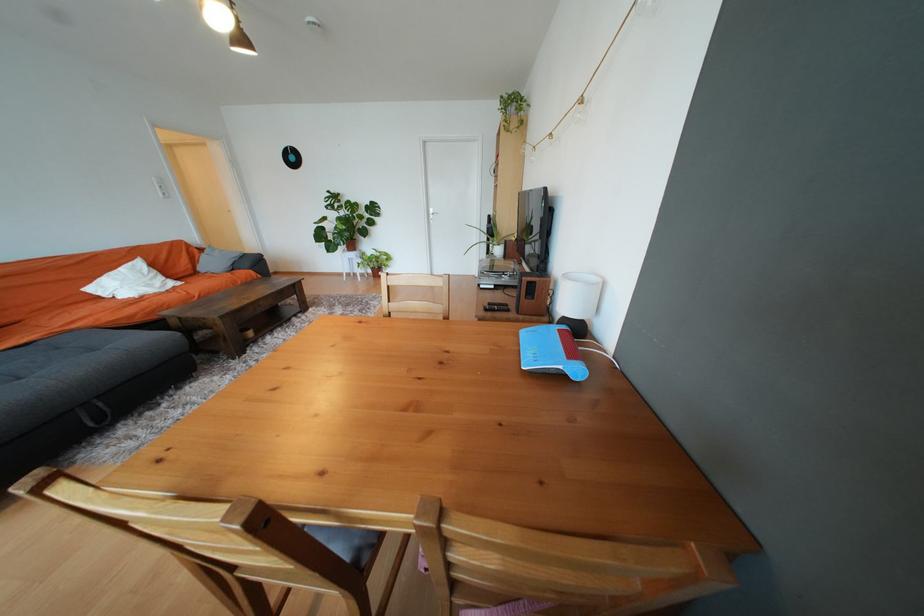
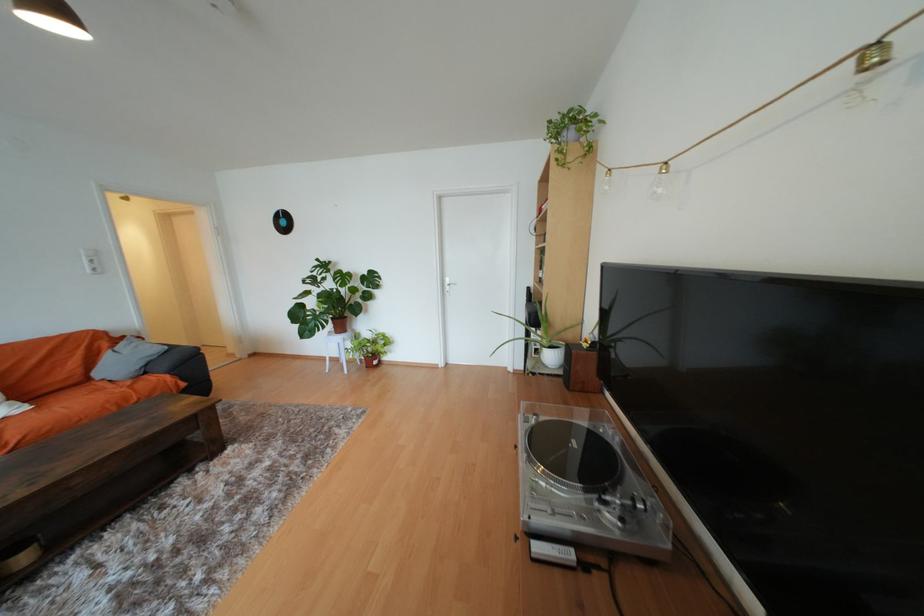
In the second image, find the point that corresponds to [186,284] in the first image.

(31, 410)